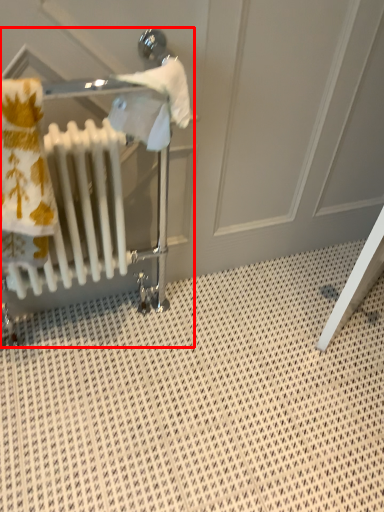
Question: From the image's perspective, where is baby carriage (annotated by the red box) located relative to radiator?

Choices:
 (A) above
 (B) below

Answer: (B)